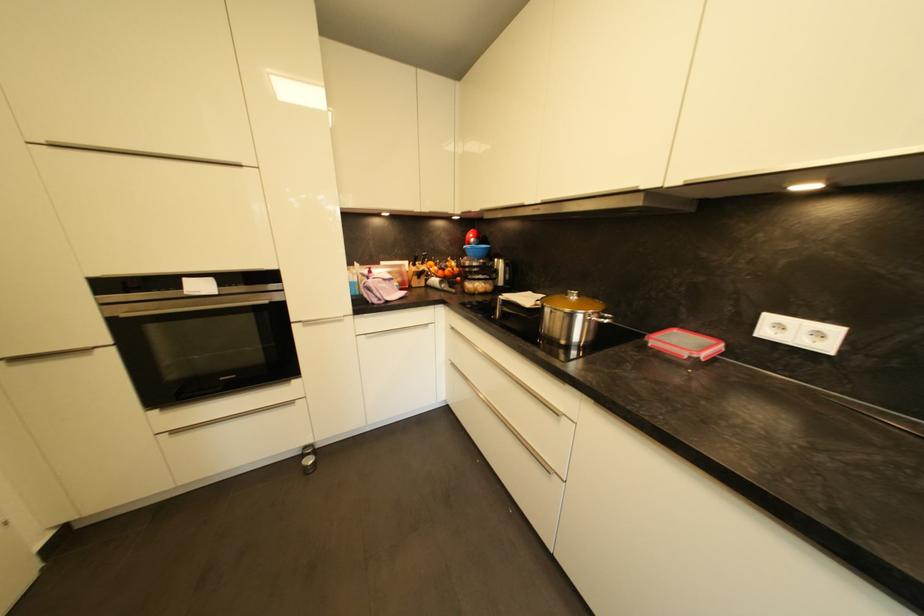
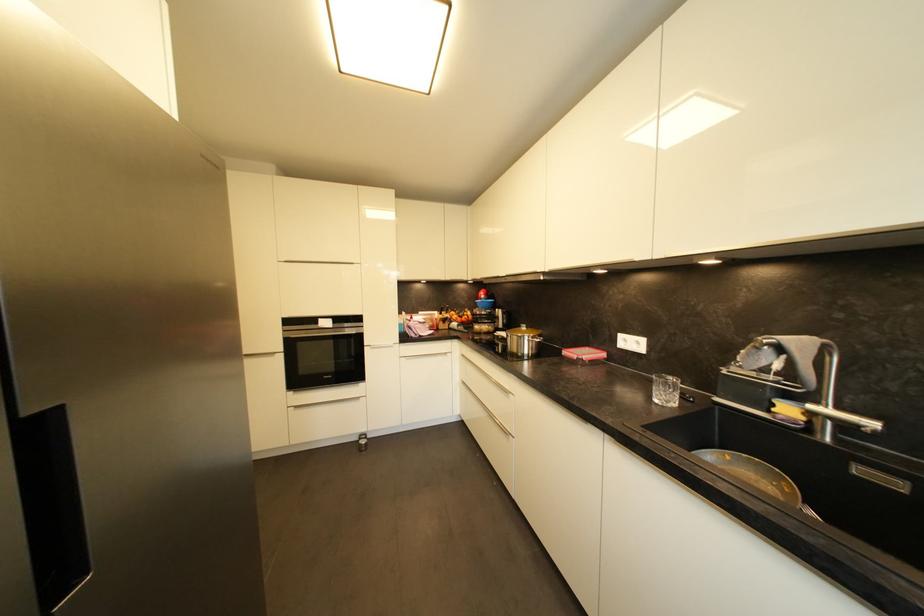
Locate, in the second image, the point that corresponds to point 309,456 in the first image.

(365, 440)